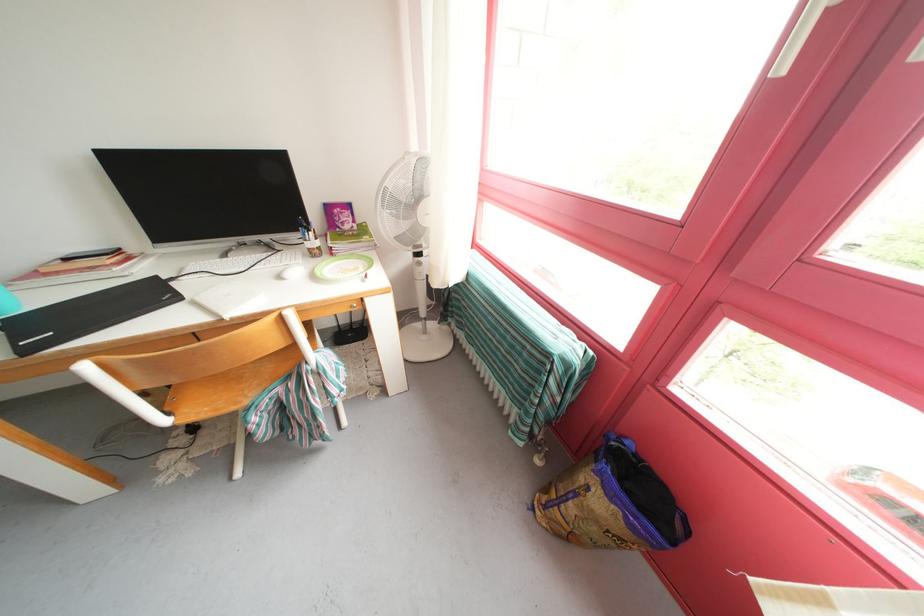
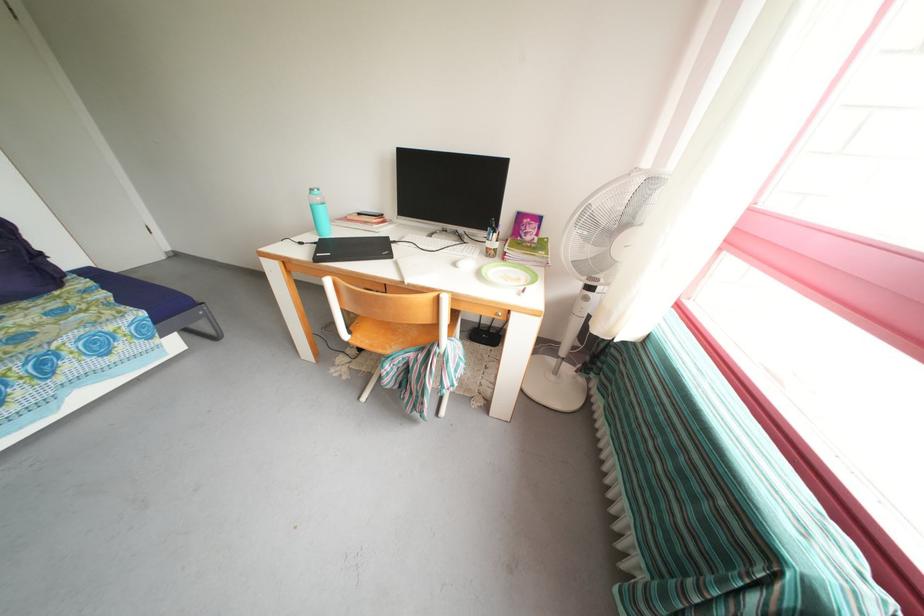
Question: The images are taken continuously from a first-person perspective. In which direction is your viewpoint rotating?

Choices:
 (A) Left
 (B) Right
 (C) Up
 (D) Down

Answer: (A)